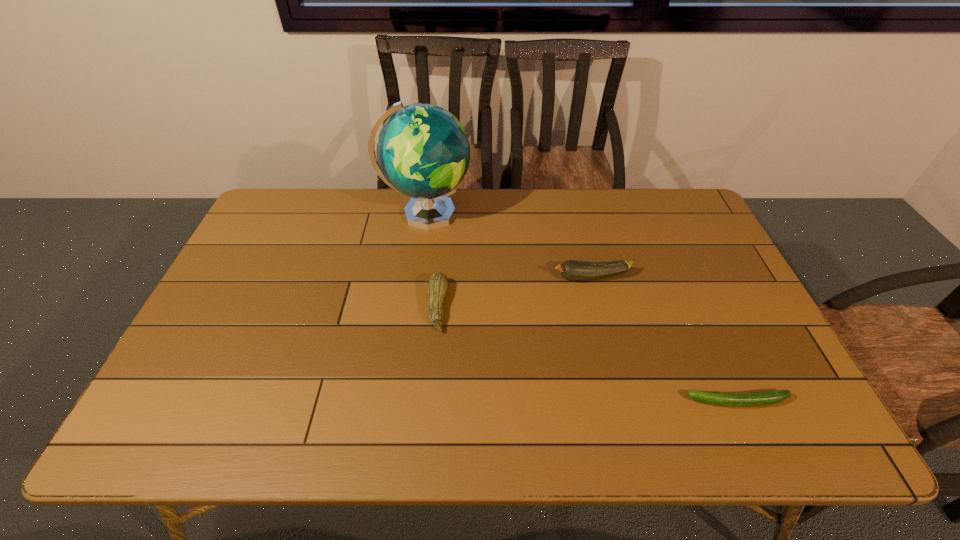
Where is `globe`? This screenshot has height=540, width=960. globe is located at coordinates (423, 151).

Where is `the tallest object`? Image resolution: width=960 pixels, height=540 pixels. the tallest object is located at coordinates coord(423,151).

In order to click on the second zucchini from left to right in this screenshot , I will do `click(574, 270)`.

Find the location of `the leftmost zucchini`. the leftmost zucchini is located at coordinates (437, 285).

You are a GUI agent. You are given a task and a screenshot of the screen. Output one action in this format:
    pyautogui.click(x=<x>, y=<y>)
    Task: Click on the nearest zucchini
    The height and width of the screenshot is (540, 960).
    Given the screenshot: What is the action you would take?
    pyautogui.click(x=752, y=399)

Locate an element on the screen. the shortest zucchini is located at coordinates (752, 399).

This screenshot has width=960, height=540. In order to click on free space located 0.290m on the front surface of the farthest object in this screenshot , I will do `click(558, 214)`.

You are a GUI agent. You are given a task and a screenshot of the screen. Output one action in this format:
    pyautogui.click(x=<x>, y=<y>)
    Task: Click on the vacant point located at the blossom end of the second object from right to left
    The width and height of the screenshot is (960, 540).
    Given the screenshot: What is the action you would take?
    pyautogui.click(x=480, y=278)

Where is `vacant area located 0.120m at the blossom end of the second object from right to left`? vacant area located 0.120m at the blossom end of the second object from right to left is located at coordinates (512, 278).

Where is `free spot located at the blossom end of the second object from right to left`? This screenshot has height=540, width=960. free spot located at the blossom end of the second object from right to left is located at coordinates (446, 278).